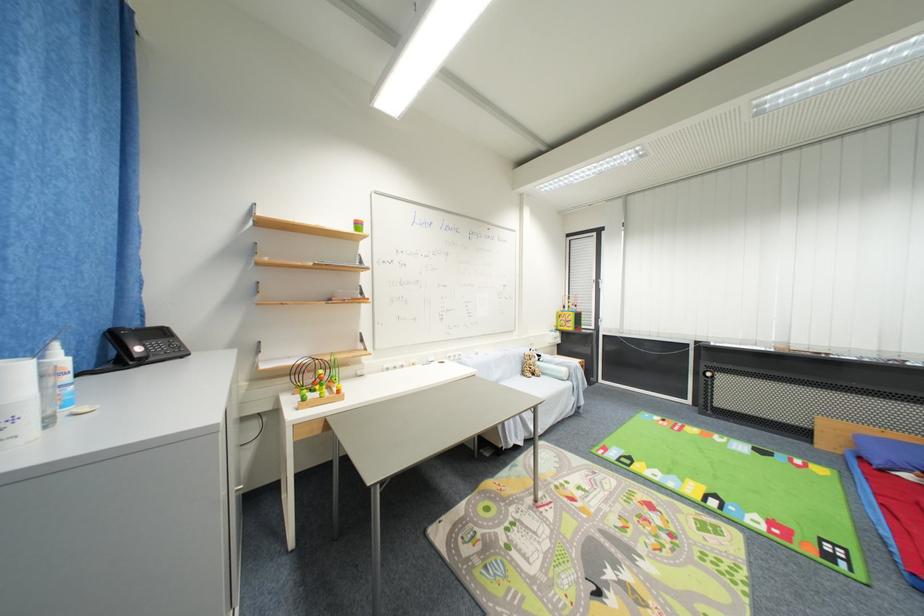
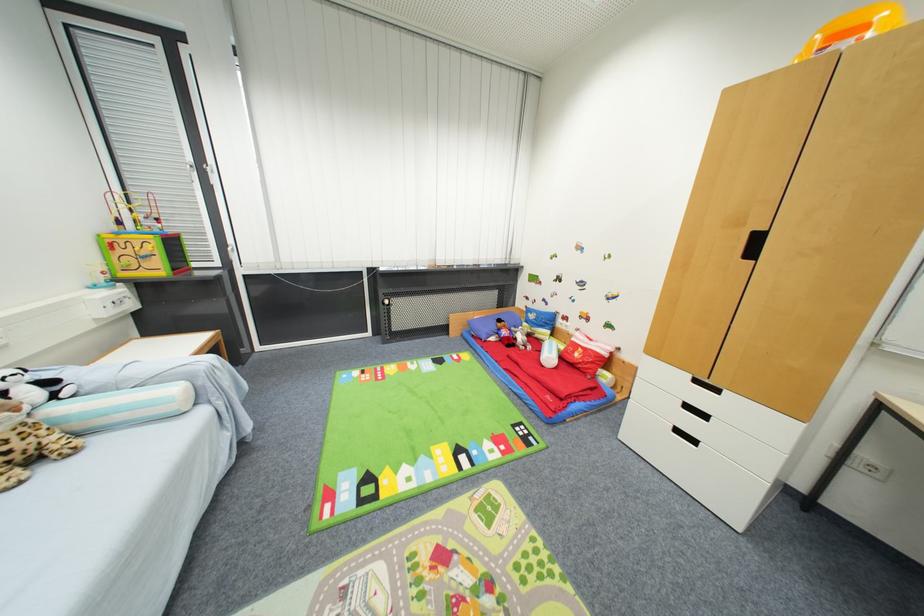
In the second image, find the point that corresponds to [882,464] in the first image.

(488, 339)